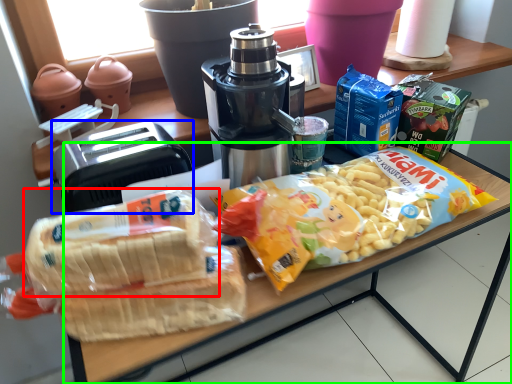
Question: Which object is the closest to the snack (highlighted by a red box)? Choose among these: toaster (highlighted by a blue box) or table (highlighted by a green box).

Choices:
 (A) toaster
 (B) table

Answer: (A)